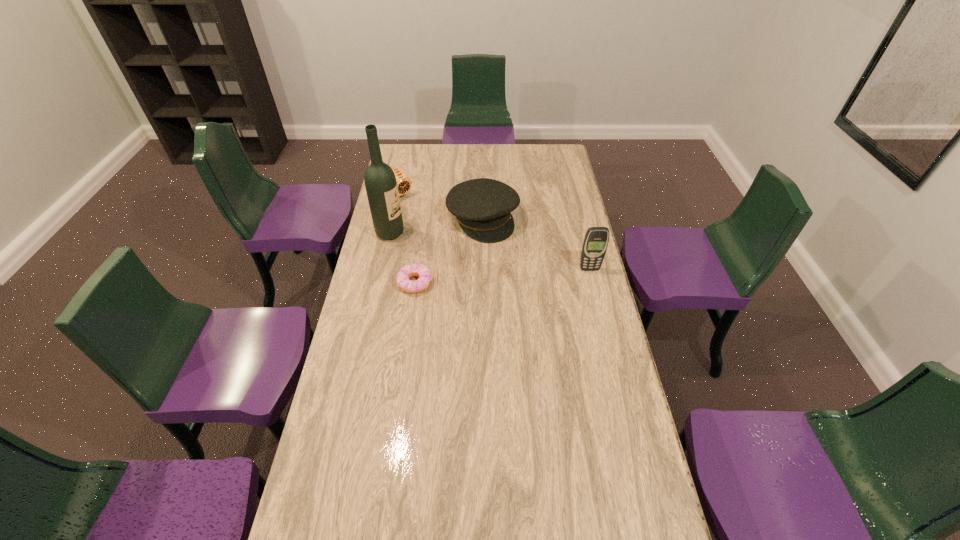
The image size is (960, 540). What are the coordinates of `free space on the desktop that is between the shortest object and the second tallest object and is positioned on the face of the watch` in the screenshot? It's located at (493, 277).

The image size is (960, 540). In order to click on vacant space on the desktop that is between the doughnut and the rightmost object and is positioned on the front-facing side of the beret in this screenshot , I will do `click(524, 274)`.

I want to click on vacant space on the desktop that is between the shortest object and the rightmost object and is positioned on the labeled side of the tallest object, so click(522, 274).